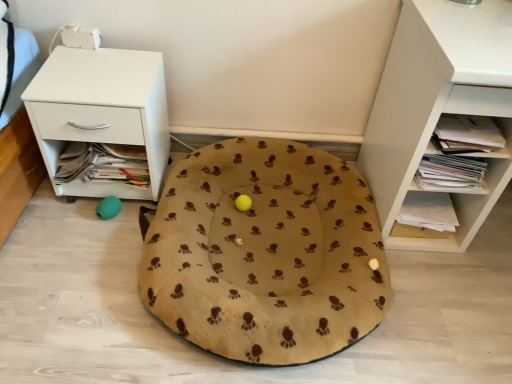
Question: Based on their sizes in the image, would you say white matte shelf at right is bigger or smaller than beige fabric dog bed at center?

Choices:
 (A) small
 (B) big

Answer: (B)

Question: Is white matte shelf at right spatially inside beige fabric dog bed at center, or outside of it?

Choices:
 (A) inside
 (B) outside

Answer: (B)

Question: Considering the real-world distances, which object is farthest from the white glossy nightstand at left?

Choices:
 (A) beige fabric dog bed at center
 (B) white matte shelf at right

Answer: (B)

Question: Which object is positioned closest to the white matte shelf at right?

Choices:
 (A) white glossy nightstand at left
 (B) beige fabric dog bed at center

Answer: (B)